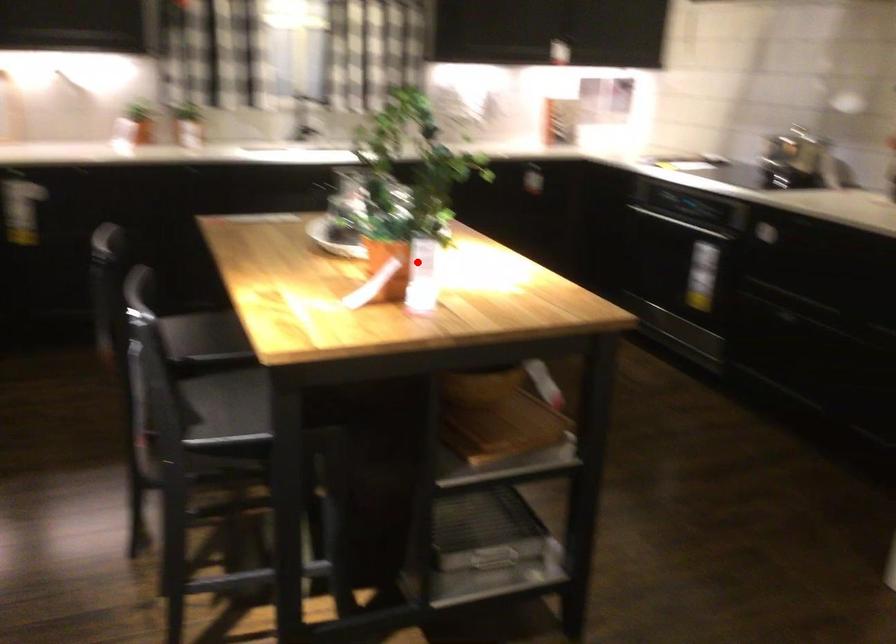
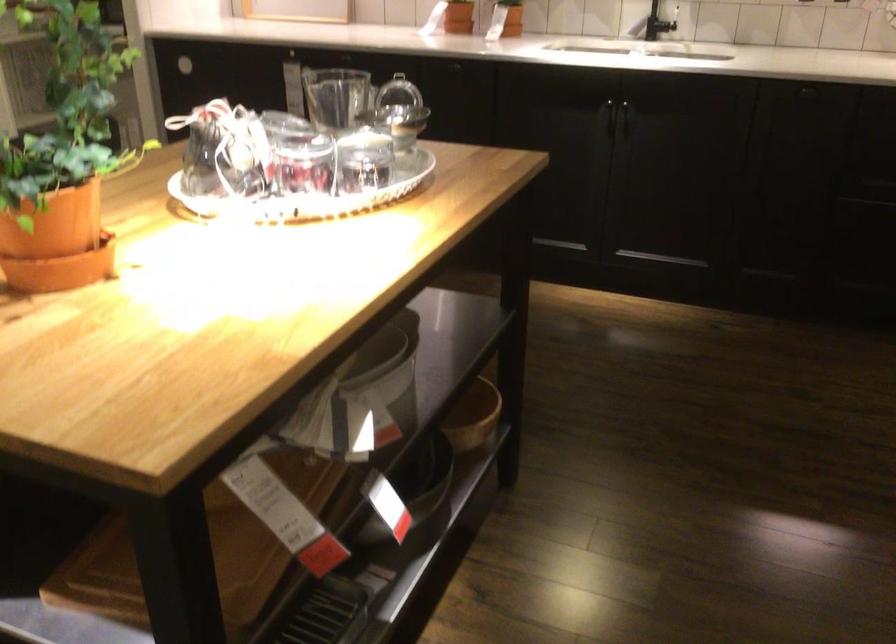
Question: I am providing you with two images of the same scene from different viewpoints. A red point is marked on the first image. Can you still see the location of the red point in image 2?

Choices:
 (A) Yes
 (B) No

Answer: (A)